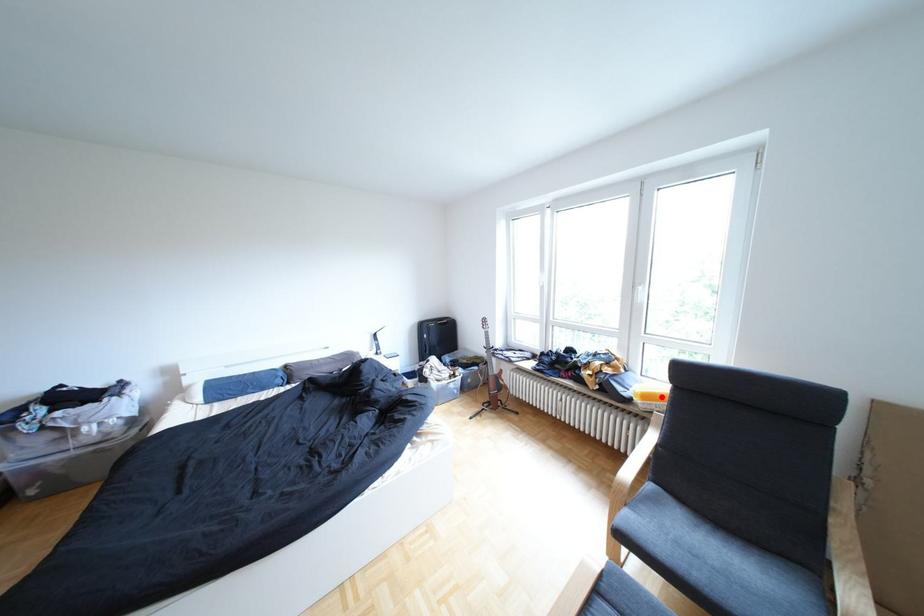
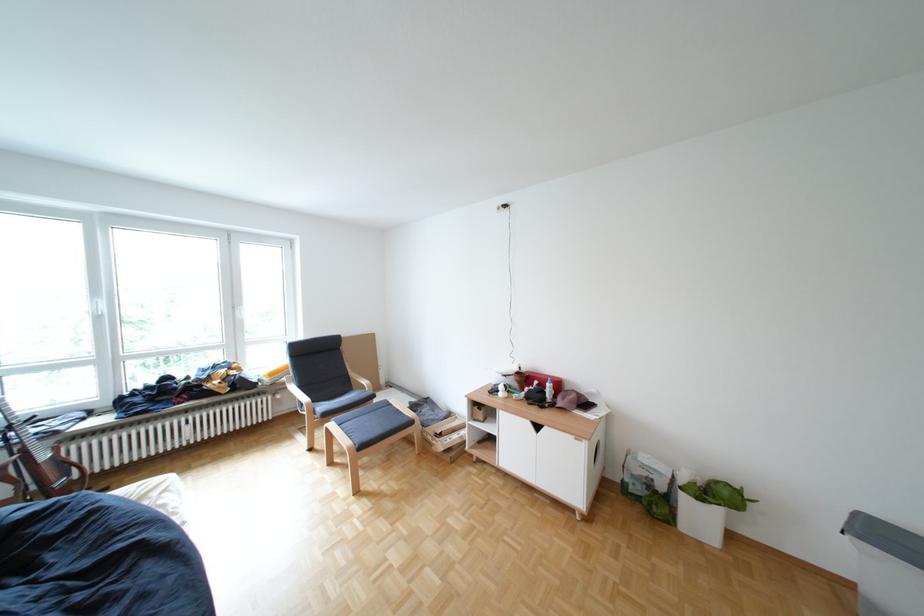
Where in the second image is the point corresponding to the highlighted location from the first image?

(286, 374)